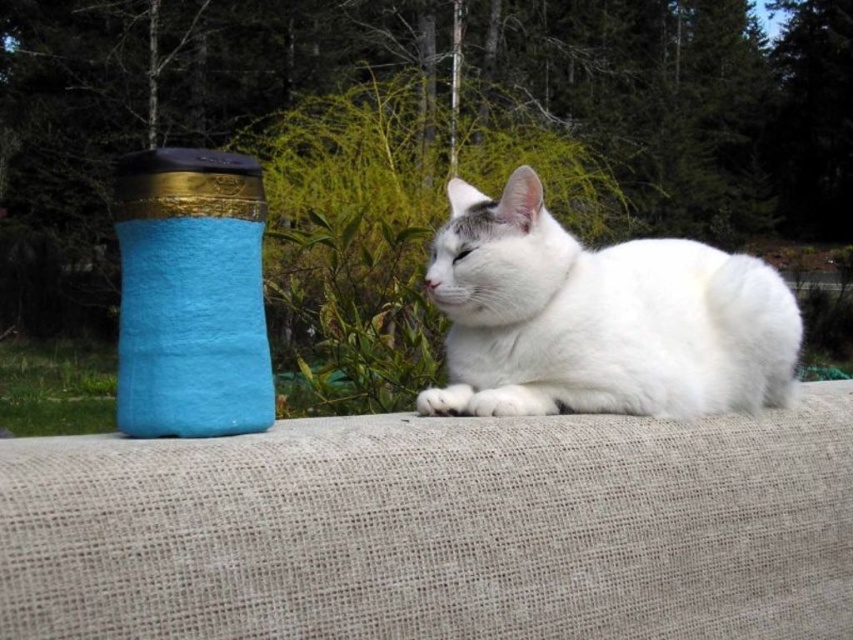
You are standing in a garden and see two points in the image. The first point is at coordinates point [569,506] and the second is at point [610,250]. Which point is nearer to you?

Point [569,506] is closer to the viewer than point [610,250].

You are trying to place a small rectangular box on the beige fabric couch at center where the white fluffy cat at center is currently lying. Can the box fit on the couch without displacing the cat?

The beige fabric couch at center is wider than the white fluffy cat at center, so there should be enough space to place the small rectangular box on the beige fabric couch at center without displacing the cat.

You are standing at the origin point in the image. Where is the beige fabric couch at center located?

The beige fabric couch at center is located at point 0.827 on the x axis and 0.515 on the y axis.